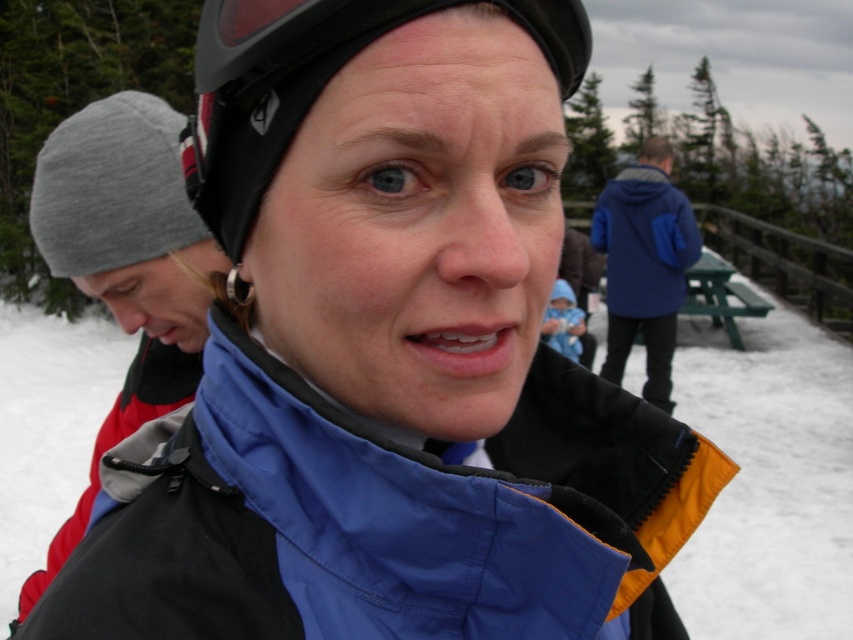
Can you confirm if blue fabric jacket at center is shorter than gray knit beanie at left?

Yes.

Where is `blue fabric jacket at center`? blue fabric jacket at center is located at coordinates (380, 516).

Image resolution: width=853 pixels, height=640 pixels. Find the location of `blue fabric jacket at center`. blue fabric jacket at center is located at coordinates (380, 516).

Is the position of gray knit beanie at left less distant than that of black matte helmet at center?

No, it is behind black matte helmet at center.

Between gray knit beanie at left and black matte helmet at center, which one appears on the right side from the viewer's perspective?

From the viewer's perspective, black matte helmet at center appears more on the right side.

Image resolution: width=853 pixels, height=640 pixels. I want to click on gray knit beanie at left, so click(125, 266).

Locate an element on the screen. gray knit beanie at left is located at coordinates (125, 266).

Does blue fabric jacket at center have a lesser width compared to black matte helmet at center?

In fact, blue fabric jacket at center might be wider than black matte helmet at center.

The image size is (853, 640). What do you see at coordinates (380, 516) in the screenshot? I see `blue fabric jacket at center` at bounding box center [380, 516].

In order to click on blue fabric jacket at center in this screenshot , I will do `click(380, 516)`.

The height and width of the screenshot is (640, 853). Find the location of `blue fabric jacket at center`. blue fabric jacket at center is located at coordinates (380, 516).